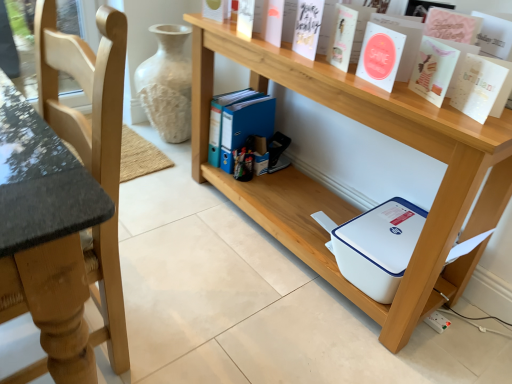
Find the location of a particular element. free space in front of matte pink card at upper right, arranged as the 2th paperback book when viewed from the right is located at coordinates (459, 120).